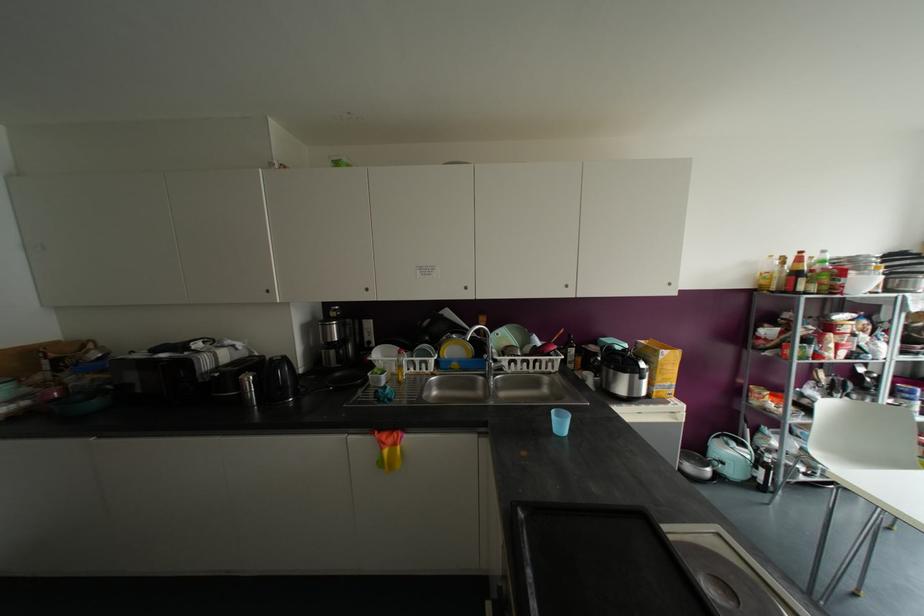
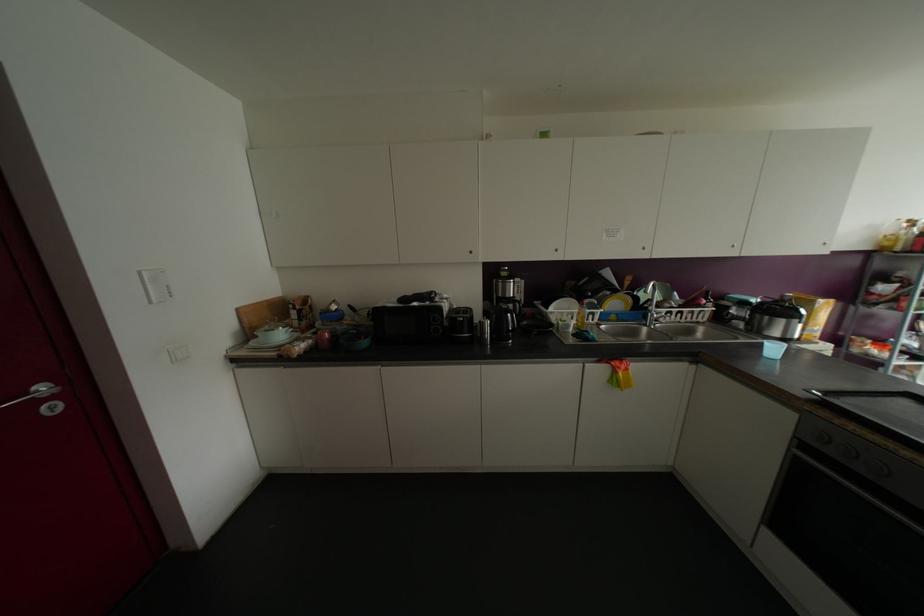
Question: What movement of the cameraman would produce the second image?

Choices:
 (A) Left
 (B) Right
 (C) Forward
 (D) Backward

Answer: (A)